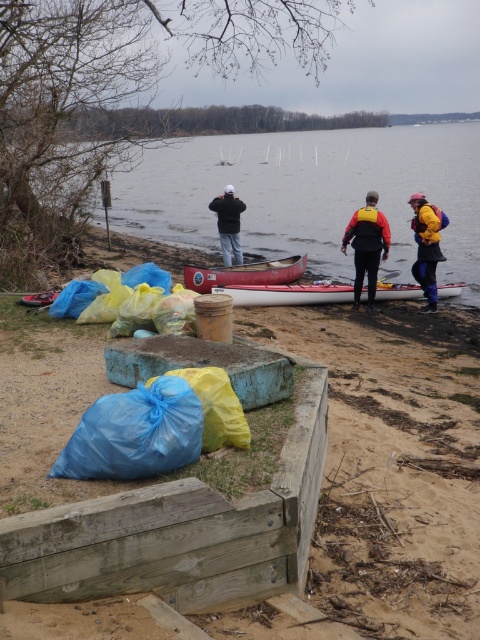
You are standing at the lakeside and want to reach a specific point marked at coordinates point (x=459, y=168). If your walking speed is 1.5 meters per second, how many seconds will it take you to reach that point?

The distance of point (x=459, y=168) from viewer is 45.97 meters. At a speed of 1.5 meters per second, it will take 45.97 divided by 1.5, which is approximately 30.65 seconds to reach the point.

You are a visitor at the lakeside and want to put your yellow waterproof jacket at right into the white matte kayak at center. Is the jacket currently positioned in a way that allows you to easily access it from the kayak?

The white matte kayak at center is to the left of the yellow waterproof jacket at right, so the jacket is positioned to the right of the kayak. This means you can easily reach the jacket from the kayak by moving to the right side of the kayak.

You are planning to store the blue plastic bag at lower left and the white matte kayak at center in a vertical storage unit. Which object should be placed first to ensure they both fit?

The blue plastic bag at lower left is taller than the white matte kayak at center, so you should place the blue plastic bag at lower left first to ensure both fit vertically in the storage unit.